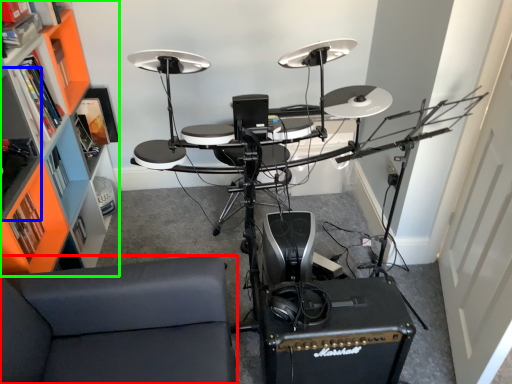
Question: Estimate the real-world distances between objects in this image. Which object is closer to furniture (highlighted by a red box), shelf (highlighted by a blue box) or bookshelf (highlighted by a green box)?

Choices:
 (A) shelf
 (B) bookshelf

Answer: (A)